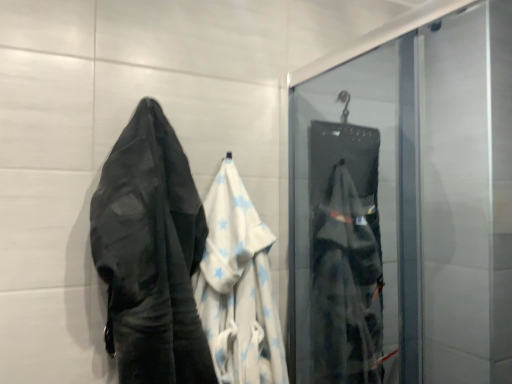
Question: Considering the relative sizes of matte black bag at right and white cotton towel at center in the image provided, is matte black bag at right shorter than white cotton towel at center?

Choices:
 (A) yes
 (B) no

Answer: (B)

Question: Does matte black bag at right appear on the right side of white cotton towel at center?

Choices:
 (A) yes
 (B) no

Answer: (A)

Question: Is matte black bag at right positioned in front of white cotton towel at center?

Choices:
 (A) yes
 (B) no

Answer: (B)

Question: From a real-world perspective, is matte black bag at right on white cotton towel at center?

Choices:
 (A) no
 (B) yes

Answer: (B)

Question: Is matte black bag at right wider than white cotton towel at center?

Choices:
 (A) yes
 (B) no

Answer: (A)

Question: Considering their positions, is matte black bag at right located in front of or behind white cotton towel at left?

Choices:
 (A) behind
 (B) front

Answer: (A)

Question: Considering the positions of point (394, 339) and point (145, 215), is point (394, 339) closer or farther from the camera than point (145, 215)?

Choices:
 (A) closer
 (B) farther

Answer: (B)

Question: In terms of height, does matte black bag at right look taller or shorter compared to white cotton towel at left?

Choices:
 (A) tall
 (B) short

Answer: (A)

Question: In the image, is matte black bag at right on the left side or the right side of white cotton towel at left?

Choices:
 (A) left
 (B) right

Answer: (B)

Question: Considering the positions of white cotton towel at left and matte black bag at right in the image, is white cotton towel at left taller or shorter than matte black bag at right?

Choices:
 (A) short
 (B) tall

Answer: (A)

Question: From a real-world perspective, relative to matte black bag at right, is white cotton towel at left vertically above or below?

Choices:
 (A) below
 (B) above

Answer: (B)

Question: In terms of width, does white cotton towel at left look wider or thinner when compared to matte black bag at right?

Choices:
 (A) wide
 (B) thin

Answer: (A)

Question: Is white cotton towel at left to the left or to the right of matte black bag at right in the image?

Choices:
 (A) left
 (B) right

Answer: (A)

Question: Considering the positions of white cotton towel at center and white cotton towel at left in the image, is white cotton towel at center taller or shorter than white cotton towel at left?

Choices:
 (A) short
 (B) tall

Answer: (A)

Question: Is white cotton towel at center spatially inside white cotton towel at left, or outside of it?

Choices:
 (A) outside
 (B) inside

Answer: (A)